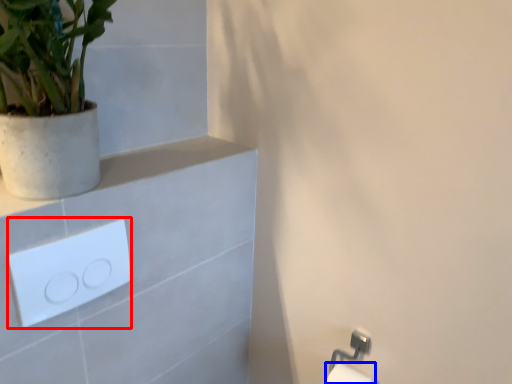
Question: Which of the following is the farthest to the observer, light switch (highlighted by a red box) or toilet paper (highlighted by a blue box)?

Choices:
 (A) light switch
 (B) toilet paper

Answer: (B)